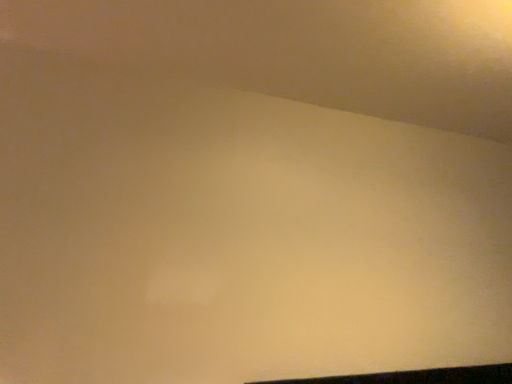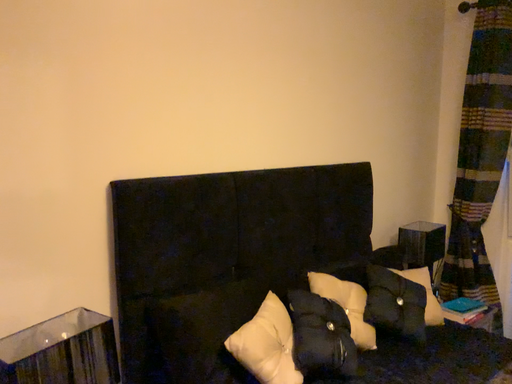
Question: How did the camera likely rotate when shooting the video?

Choices:
 (A) rotated upward
 (B) rotated downward

Answer: (B)